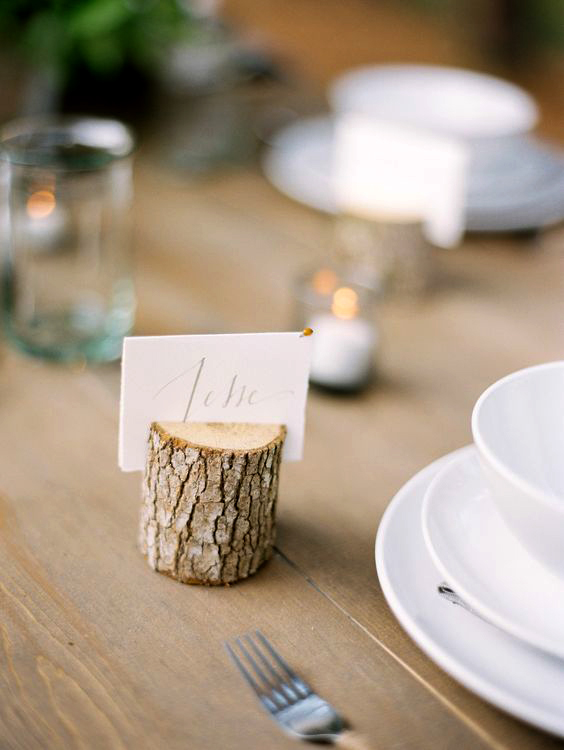
Locate an element on the screen. tea light is located at coordinates (336, 322).